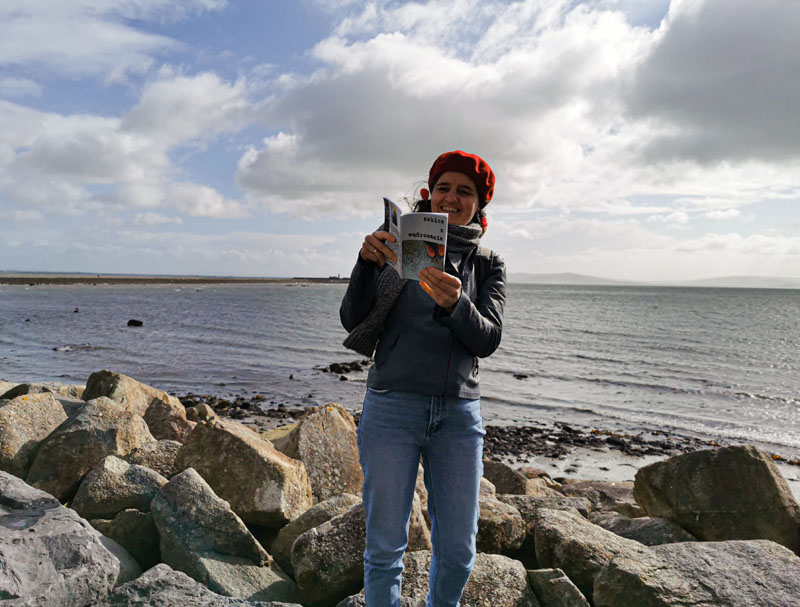
Where is `front cover of book`? front cover of book is located at coordinates (430, 249).